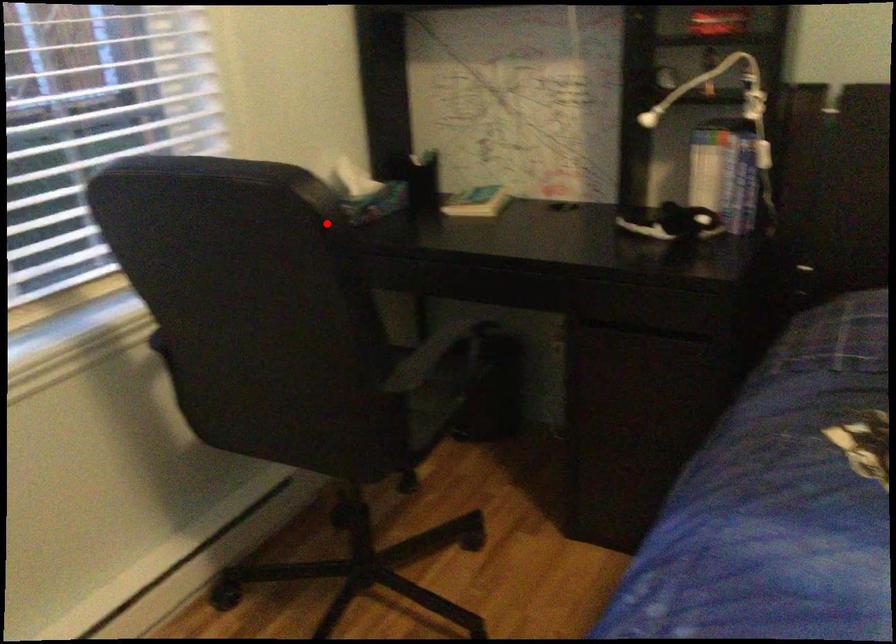
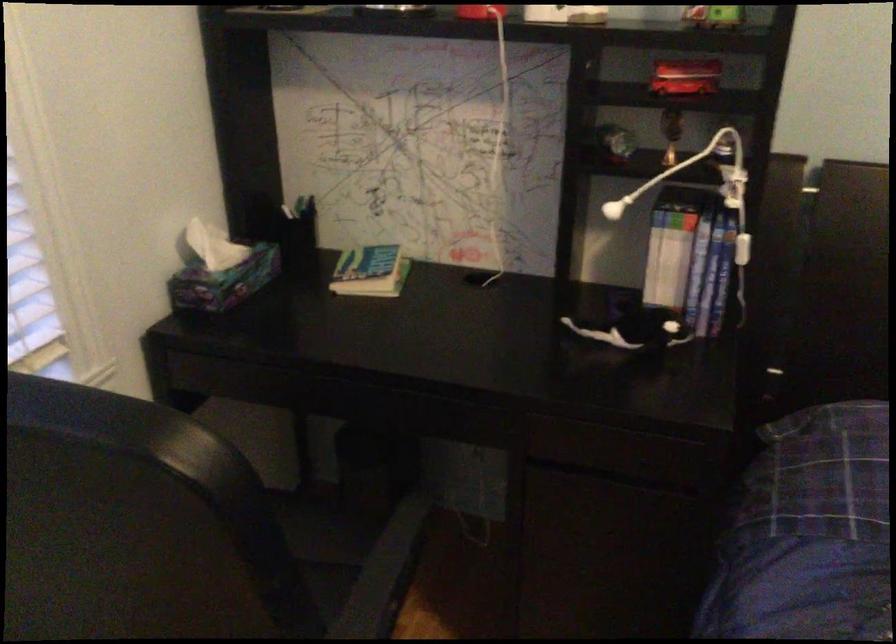
The point at the highlighted location is marked in the first image. Where is the corresponding point in the second image?

(234, 509)